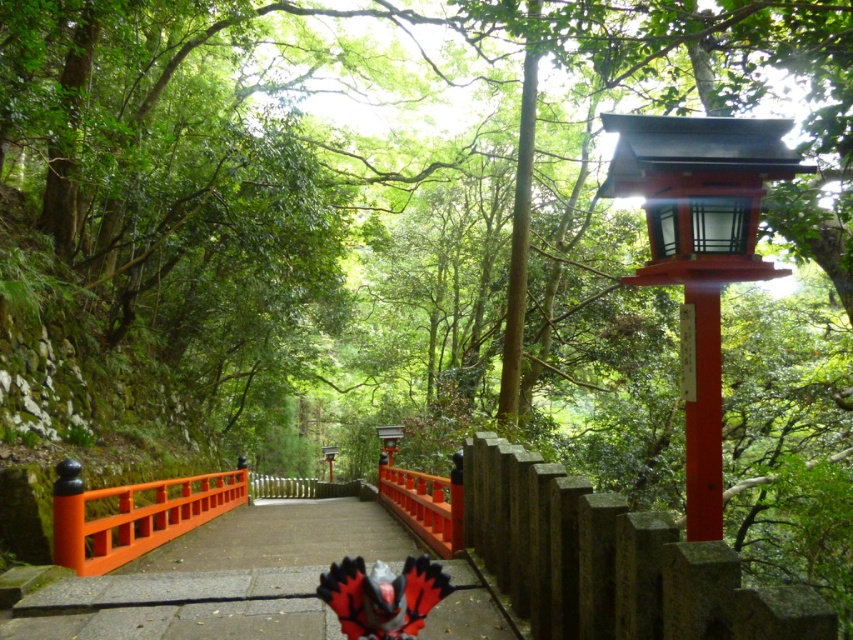
Question: Does smooth wooden bridge at center have a smaller size compared to orange matte/wooden rail at center?

Choices:
 (A) yes
 (B) no

Answer: (B)

Question: Which point is farther from the camera taking this photo?

Choices:
 (A) (131, 548)
 (B) (312, 605)

Answer: (A)

Question: Does smooth wooden bridge at center appear on the right side of orange matte/wooden rail at center?

Choices:
 (A) yes
 (B) no

Answer: (A)

Question: Is smooth wooden bridge at center to the left of orange matte/wooden rail at center from the viewer's perspective?

Choices:
 (A) no
 (B) yes

Answer: (A)

Question: Which point is closer to the camera?

Choices:
 (A) orange matte/wooden rail at center
 (B) smooth wooden bridge at center

Answer: (B)

Question: Among these points, which one is nearest to the camera?

Choices:
 (A) (161, 596)
 (B) (184, 484)

Answer: (A)